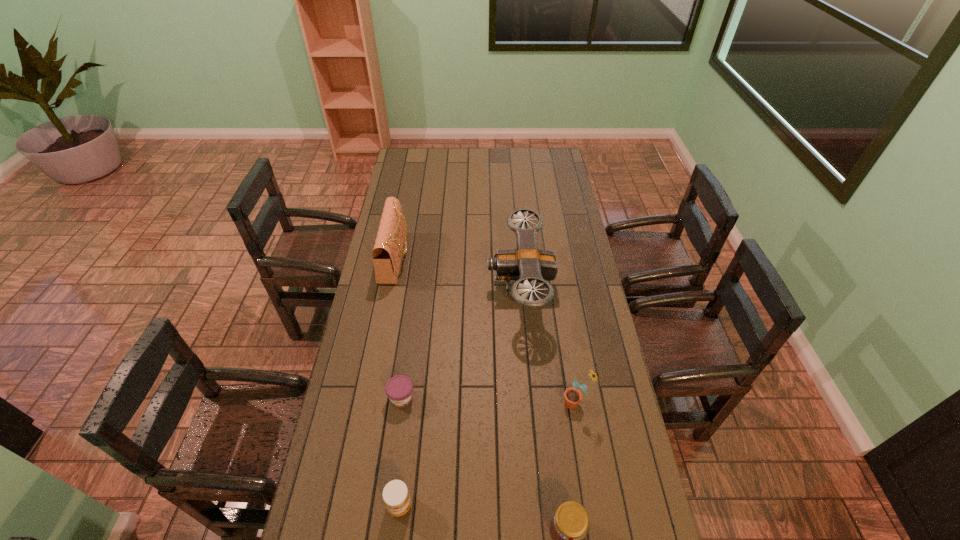
In the image, there is a desktop. Identify the location of vacant space at the far left corner. (x=414, y=154).

Image resolution: width=960 pixels, height=540 pixels. I want to click on free space between the drone and the sunflower, so click(548, 345).

Where is `vacant region between the shortest jam and the sunflower`? The image size is (960, 540). vacant region between the shortest jam and the sunflower is located at coordinates (489, 400).

Find the location of `free space that is in between the handbag and the drone`. free space that is in between the handbag and the drone is located at coordinates (458, 272).

The image size is (960, 540). In order to click on vacant area that lies between the sunflower and the shortest jam in this screenshot , I will do `click(489, 400)`.

Identify the location of free point between the shortest object and the handbag. This screenshot has width=960, height=540. (398, 327).

Locate which object ranks third in proximity to the rightmost jam. Please provide its 2D coordinates. Your answer should be formatted as a tuple, i.e. [(x, y)], where the tuple contains the x and y coordinates of a point satisfying the conditions above.

[(399, 389)]

What are the coordinates of `the fourth closest object to the shortest jam` in the screenshot? It's located at (572, 396).

Identify the location of jam object that ranks as the third closest to the leftmost object. Image resolution: width=960 pixels, height=540 pixels. (569, 526).

You are a GUI agent. You are given a task and a screenshot of the screen. Output one action in this format:
    pyautogui.click(x=<x>, y=<y>)
    Task: Click on the closest jam relative to the rightmost jam
    This screenshot has width=960, height=540.
    Given the screenshot: What is the action you would take?
    pyautogui.click(x=396, y=497)